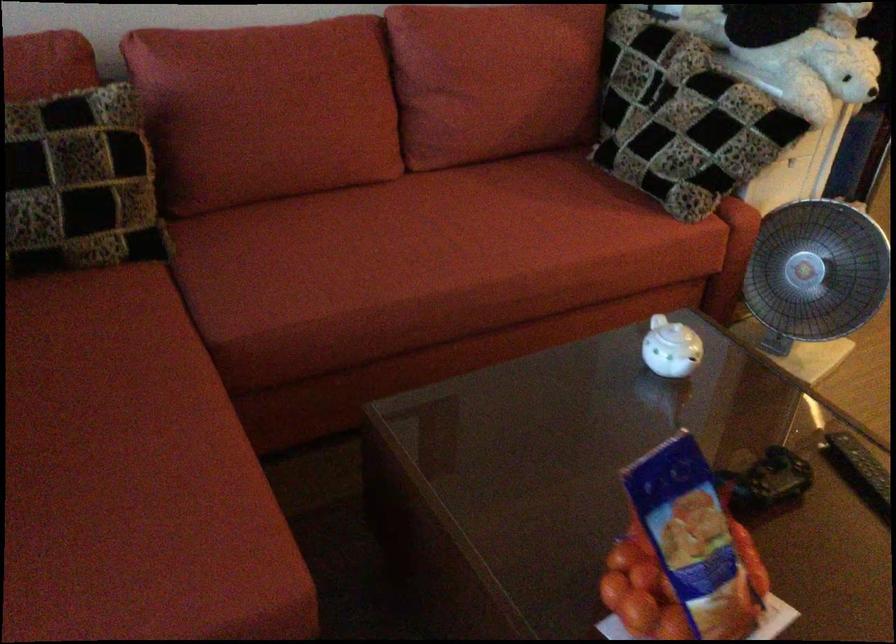
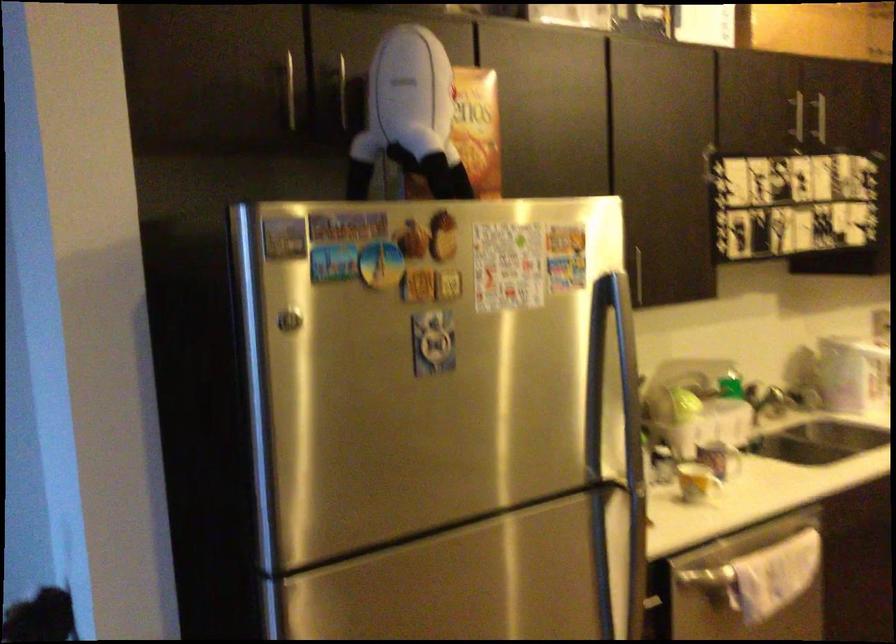
What movement of the cameraman would produce the second image?

The movement direction of the cameraman is right, forward.